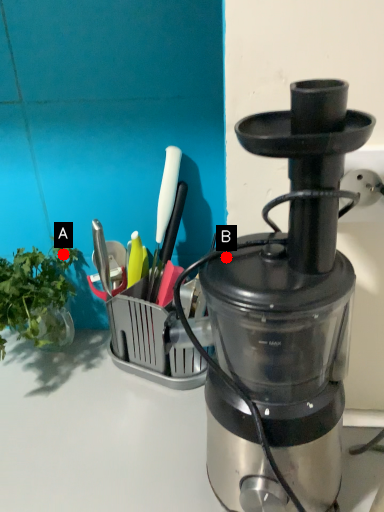
Question: Two points are circled on the image, labeled by A and B beside each circle. Which of the following is the closest to the observer?

Choices:
 (A) A is closer
 (B) B is closer

Answer: (B)